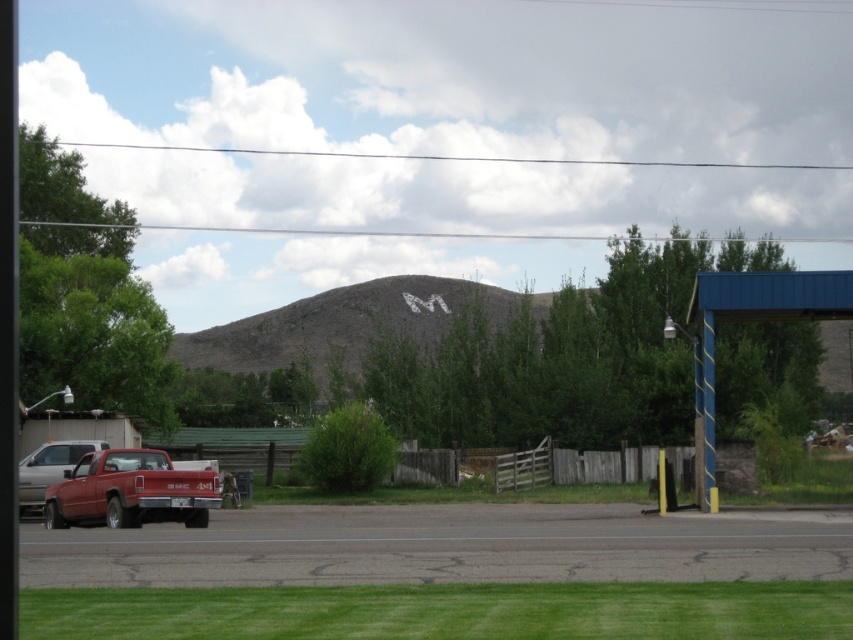
The image size is (853, 640). What do you see at coordinates (131, 492) in the screenshot?
I see `matte red pickup truck at lower left` at bounding box center [131, 492].

Is matte red pickup truck at lower left behind matte red truck at lower left?

No, matte red pickup truck at lower left is in front of matte red truck at lower left.

Identify the location of matte red pickup truck at lower left. The image size is (853, 640). (131, 492).

Does gray rocky mountain at center have a larger size compared to matte red pickup truck at lower left?

Indeed, gray rocky mountain at center has a larger size compared to matte red pickup truck at lower left.

Is gray rocky mountain at center above matte red pickup truck at lower left?

Yes.

The image size is (853, 640). In order to click on gray rocky mountain at center in this screenshot , I will do tap(349, 323).

The width and height of the screenshot is (853, 640). Describe the element at coordinates (349, 323) in the screenshot. I see `gray rocky mountain at center` at that location.

Locate an element on the screen. gray rocky mountain at center is located at coordinates (349, 323).

Locate an element on the screen. The image size is (853, 640). gray rocky mountain at center is located at coordinates (349, 323).